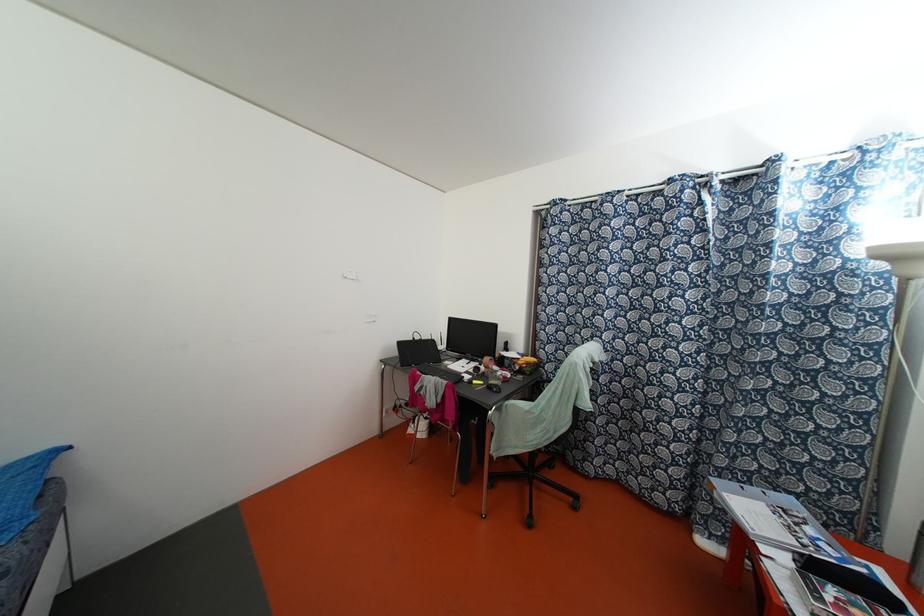
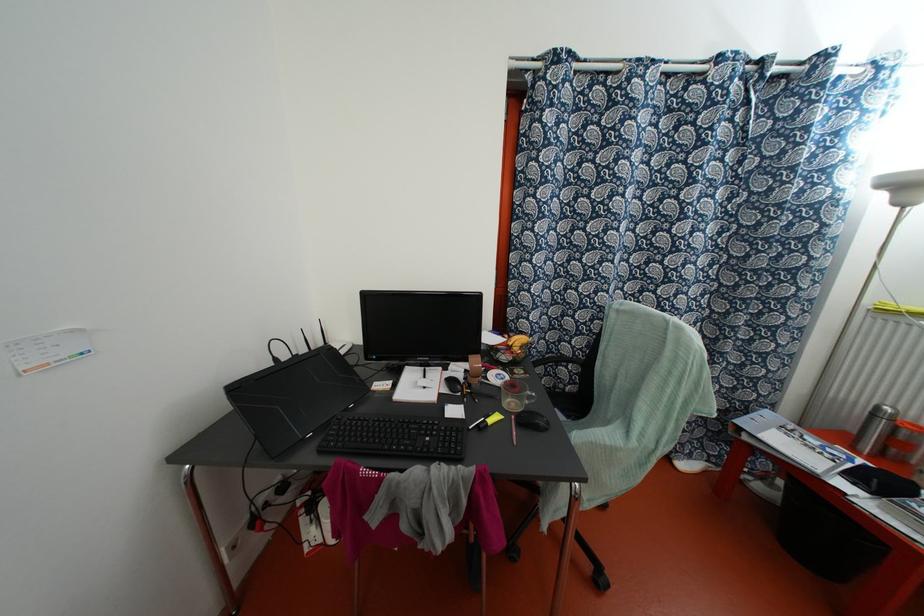
Locate, in the second image, the point that corresponds to the point at 516,368 in the first image.

(504, 357)